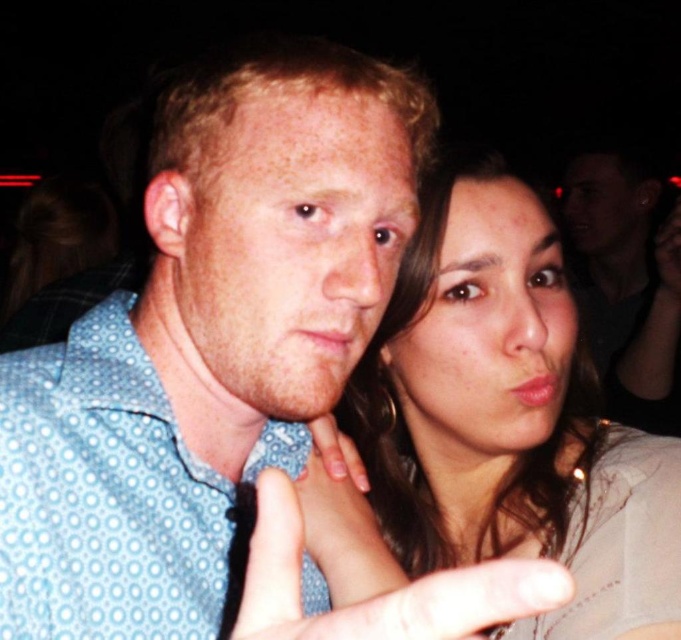
You are at a party and want to take a photo of the matte black shirt at upper right without the white matte finger at center blocking it. How should you adjust your position?

Move your camera position so that the white matte finger at center is no longer in front of the matte black shirt at upper right. Since the white matte finger at center is behind the matte black shirt at upper right, moving the camera to the side or angle might allow you to capture the matte black shirt at upper right without obstruction.

You are standing at the origin point in the image. Which object is closer to you, the matte gray shirt at center or the light blue shirt with a subtle pattern of small white dots?

The matte gray shirt at center is located at point (492, 426), while the light blue shirt with a subtle pattern of small white dots is not mentioned in the Objects Description. However, based on the coordinates, the matte gray shirt is closer to the origin point, so the matte gray shirt at center is closer to you.

You are organizing a clothing display and need to arrange the matte gray shirt at center and the matte black shirt at upper right based on their positions in the image. Which shirt should be placed lower in the display to match the image?

The matte gray shirt at center should be placed lower in the display because it is below the matte black shirt at upper right in the image.